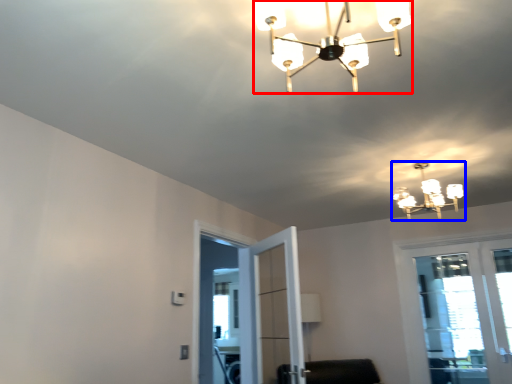
Question: Which object is closer to the camera taking this photo, lamp (highlighted by a red box) or lamp (highlighted by a blue box)?

Choices:
 (A) lamp
 (B) lamp

Answer: (A)